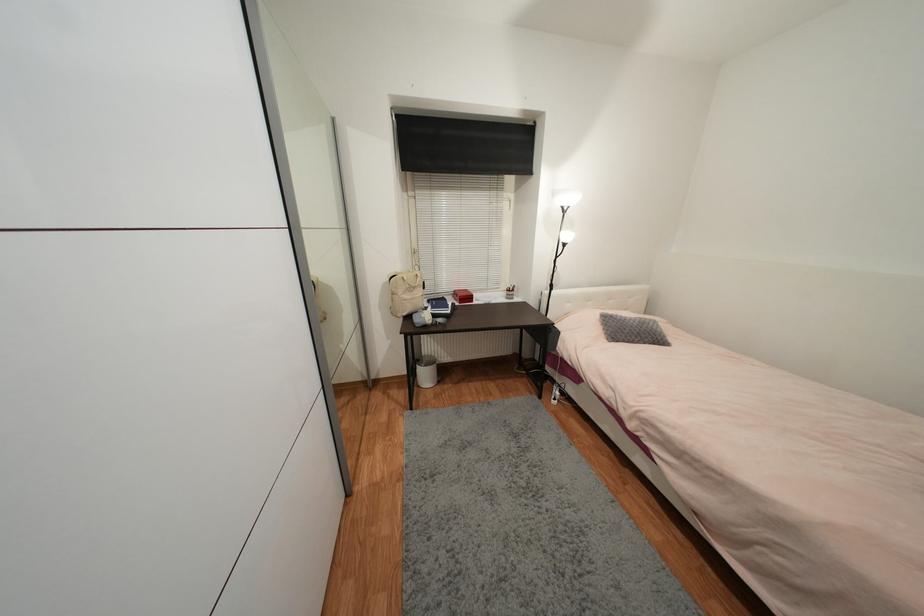
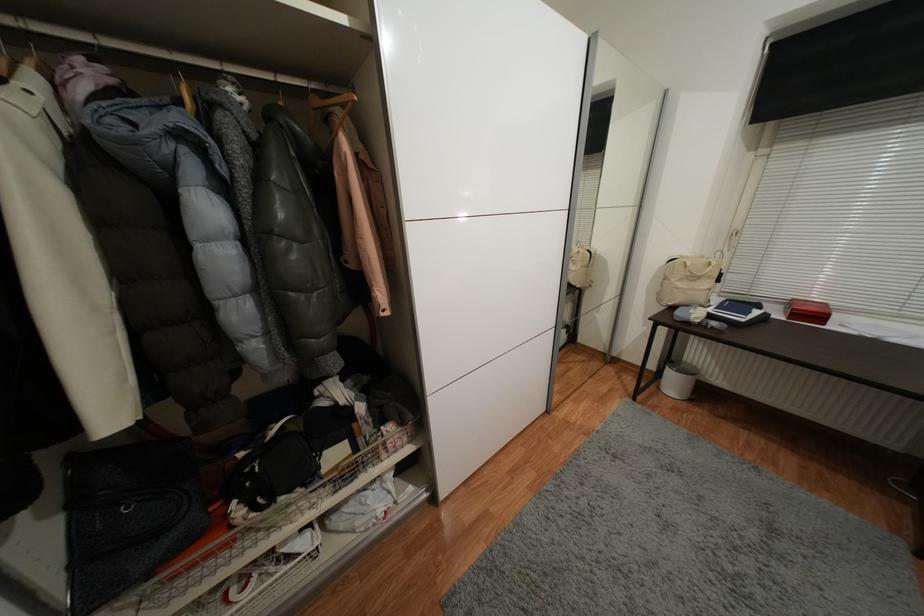
Where in the second image is the point corresponding to (475,300) from the first image?

(824, 318)